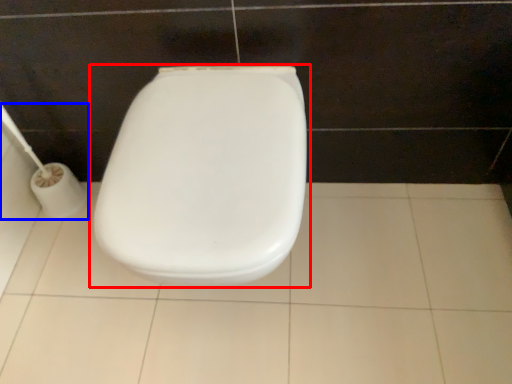
Question: Which of the following is the closest to the observer, toilet (highlighted by a red box) or toilet paper (highlighted by a blue box)?

Choices:
 (A) toilet
 (B) toilet paper

Answer: (A)